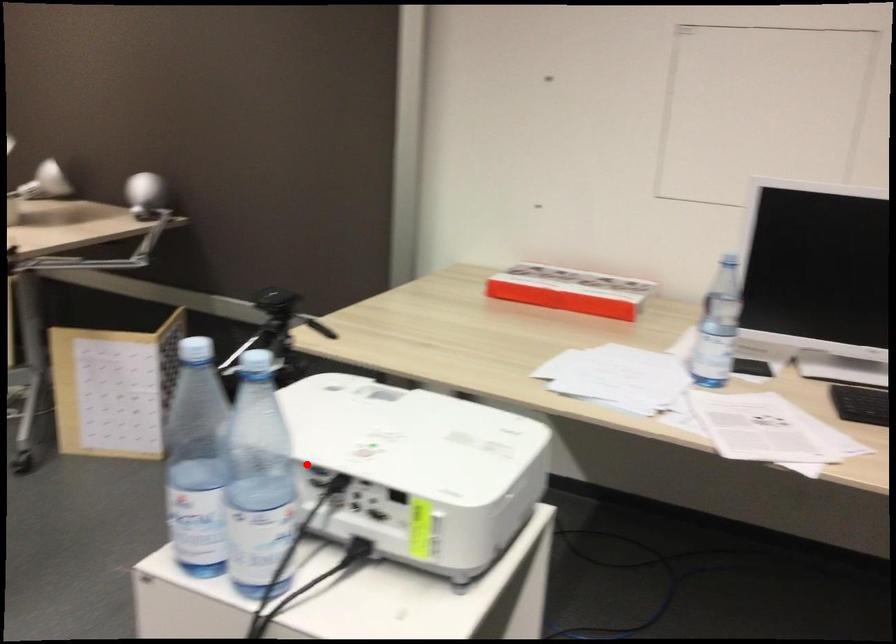
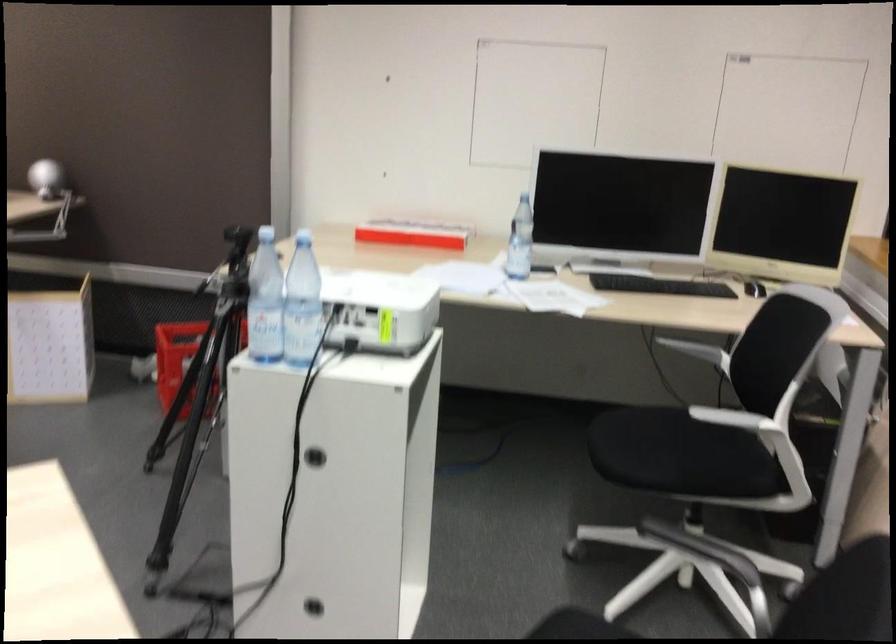
Question: I am providing you with two images of the same scene from different viewpoints. A red point is shown in image1. For the corresponding object point in image2, is it positioned nearer or farther from the camera?

Choices:
 (A) Nearer
 (B) Farther

Answer: (B)